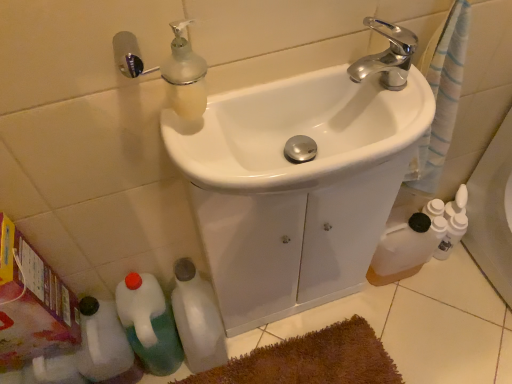
Image resolution: width=512 pixels, height=384 pixels. Describe the element at coordinates (197, 318) in the screenshot. I see `white matte bottle at lower left, which is the 3th bottle from left to right` at that location.

The height and width of the screenshot is (384, 512). What do you see at coordinates (149, 323) in the screenshot?
I see `green plastic bottle at lower left, the second bottle viewed from the left` at bounding box center [149, 323].

Identify the location of white plastic bottle at lower left, acting as the first bottle starting from the left. (104, 345).

What is the approximate width of white plastic bottle at lower left, which appears as the third bottle when viewed from the right?

7.76 inches.

Describe the element at coordinates (300, 180) in the screenshot. The width and height of the screenshot is (512, 384). I see `white glossy sink at center, the 1th sink when ordered from back to front` at that location.

Where is `white matte bottle at lower left, which is the 3th bottle from left to right`? This screenshot has width=512, height=384. white matte bottle at lower left, which is the 3th bottle from left to right is located at coordinates (197, 318).

Considering the positions of points (156, 320) and (169, 145), is point (156, 320) farther from camera compared to point (169, 145)?

Yes.

Could you tell me if green plastic bottle at lower left, the second bottle viewed from the left, is turned towards white glossy sink at center, the 2th sink viewed from the front?

No, green plastic bottle at lower left, the second bottle viewed from the left, is not facing towards white glossy sink at center, the 2th sink viewed from the front.

There is a white glossy sink at center, the 2th sink viewed from the front. Where is `the 1st bottle below it (from a real-world perspective)`? The width and height of the screenshot is (512, 384). the 1st bottle below it (from a real-world perspective) is located at coordinates (149, 323).

Considering the sizes of green plastic bottle at lower left, the second bottle viewed from the left, and white glossy sink at center, the 2th sink viewed from the front, in the image, is green plastic bottle at lower left, the second bottle viewed from the left, bigger or smaller than white glossy sink at center, the 2th sink viewed from the front,?

In the image, green plastic bottle at lower left, the second bottle viewed from the left, appears to be smaller than white glossy sink at center, the 2th sink viewed from the front.

From the picture: From a real-world perspective, is white plastic bottle at lower left, which appears as the third bottle when viewed from the right, above or below white glossy sink at center, the 1th sink when ordered from back to front?

white plastic bottle at lower left, which appears as the third bottle when viewed from the right, is below white glossy sink at center, the 1th sink when ordered from back to front.

Which of these two, white plastic bottle at lower left, which appears as the third bottle when viewed from the right, or white glossy sink at center, the 2th sink viewed from the front, stands shorter?

Result: Standing shorter between the two is white plastic bottle at lower left, which appears as the third bottle when viewed from the right.

Is white plastic bottle at lower left, which appears as the third bottle when viewed from the right, far away from white glossy sink at center, the 2th sink viewed from the front?

No, white plastic bottle at lower left, which appears as the third bottle when viewed from the right, is not far from white glossy sink at center, the 2th sink viewed from the front.

Is white matte bottle at lower left, which is the 3th bottle from left to right, surrounded by white plastic bottle at lower left, acting as the first bottle starting from the left?

No, white matte bottle at lower left, which is the 3th bottle from left to right, is located outside of white plastic bottle at lower left, acting as the first bottle starting from the left.

Is white plastic bottle at lower left, which appears as the third bottle when viewed from the right, in contact with white matte bottle at lower left, which is the 3th bottle from left to right?

No, white plastic bottle at lower left, which appears as the third bottle when viewed from the right, is not next to white matte bottle at lower left, which is the 3th bottle from left to right.

Considering the relative sizes of white plastic bottle at lower left, which appears as the third bottle when viewed from the right, and white matte bottle at lower left, which is the 1th bottle in right-to-left order, in the image provided, is white plastic bottle at lower left, which appears as the third bottle when viewed from the right, wider than white matte bottle at lower left, which is the 1th bottle in right-to-left order,?

No.

From the image's perspective, does green plastic bottle at lower left, which is the second bottle from right to left, appear higher than white glossy sink at center, positioned as the first sink in front-to-back order?

Incorrect, from the image's perspective, green plastic bottle at lower left, which is the second bottle from right to left, is lower than white glossy sink at center, positioned as the first sink in front-to-back order.

Which of these two, green plastic bottle at lower left, the second bottle viewed from the left, or white glossy sink at center, the 2th sink viewed from the back, is thinner?

green plastic bottle at lower left, the second bottle viewed from the left.

Between green plastic bottle at lower left, the second bottle viewed from the left, and white glossy sink at center, the 2th sink viewed from the back, which one has more height?

green plastic bottle at lower left, the second bottle viewed from the left, is taller.

How much distance is there between green plastic bottle at lower left, which is the second bottle from right to left, and white glossy sink at center, positioned as the first sink in front-to-back order?

23.97 inches.

Which point is more distant from viewer, (303, 120) or (150, 356)?

The point (150, 356) is more distant.

Is white glossy sink at center, positioned as the first sink in front-to-back order, wider than green plastic bottle at lower left, which is the second bottle from right to left?

Indeed, white glossy sink at center, positioned as the first sink in front-to-back order, has a greater width compared to green plastic bottle at lower left, which is the second bottle from right to left.

From the image's perspective, is white glossy sink at center, positioned as the first sink in front-to-back order, on green plastic bottle at lower left, which is the second bottle from right to left?

Indeed, from the image's perspective, white glossy sink at center, positioned as the first sink in front-to-back order, is shown above green plastic bottle at lower left, which is the second bottle from right to left.

How distant is white glossy sink at center, positioned as the first sink in front-to-back order, from green plastic bottle at lower left, the second bottle viewed from the left?

The distance of white glossy sink at center, positioned as the first sink in front-to-back order, from green plastic bottle at lower left, the second bottle viewed from the left, is 23.97 inches.

Does brown plush bath mat at lower center have a lesser height compared to white glossy sink at center, the 2th sink viewed from the back?

Yes, brown plush bath mat at lower center is shorter than white glossy sink at center, the 2th sink viewed from the back.

Considering the relative positions of brown plush bath mat at lower center and white glossy sink at center, positioned as the first sink in front-to-back order, in the image provided, is brown plush bath mat at lower center to the right of white glossy sink at center, positioned as the first sink in front-to-back order, from the viewer's perspective?

No, brown plush bath mat at lower center is not to the right of white glossy sink at center, positioned as the first sink in front-to-back order.

Between brown plush bath mat at lower center and white glossy sink at center, positioned as the first sink in front-to-back order, which one has smaller size?

With smaller size is brown plush bath mat at lower center.

What's the angular difference between brown plush bath mat at lower center and white glossy sink at center, the 2th sink viewed from the back,'s facing directions?

The angular difference between brown plush bath mat at lower center and white glossy sink at center, the 2th sink viewed from the back, is 89.4 degrees.

Between point (262, 146) and point (135, 369), which one is positioned in front?

The point (262, 146) is more forward.

Is white plastic bottle at lower left, acting as the first bottle starting from the left, a part of white glossy sink at center, positioned as the first sink in front-to-back order?

No, white plastic bottle at lower left, acting as the first bottle starting from the left, is not a part of white glossy sink at center, positioned as the first sink in front-to-back order.

Is white glossy sink at center, positioned as the first sink in front-to-back order, next to white plastic bottle at lower left, which appears as the third bottle when viewed from the right?

No, white glossy sink at center, positioned as the first sink in front-to-back order, is not touching white plastic bottle at lower left, which appears as the third bottle when viewed from the right.

From the image's perspective, would you say white glossy sink at center, positioned as the first sink in front-to-back order, is shown under white plastic bottle at lower left, which appears as the third bottle when viewed from the right?

No, from the image's perspective, white glossy sink at center, positioned as the first sink in front-to-back order, is not below white plastic bottle at lower left, which appears as the third bottle when viewed from the right.

Find the location of a particular element. The height and width of the screenshot is (384, 512). the 1st bottle behind the white glossy sink at center, the 1th sink when ordered from back to front is located at coordinates (149, 323).

From the image's perspective, starting from the white plastic bottle at lower left, which appears as the third bottle when viewed from the right, which sink is the 1st one above? Please provide its 2D coordinates.

[(300, 180)]

Which object lies nearer to the anchor point white plastic bottle at lower left, which appears as the third bottle when viewed from the right, green plastic bottle at lower left, the second bottle viewed from the left, or white glossy sink at center, positioned as the first sink in front-to-back order?

The object closer to white plastic bottle at lower left, which appears as the third bottle when viewed from the right, is green plastic bottle at lower left, the second bottle viewed from the left.

From the picture: When comparing their distances from white glossy sink at center, the 2th sink viewed from the front, does white plastic bottle at lower left, which appears as the third bottle when viewed from the right, or white glossy sink at center, positioned as the first sink in front-to-back order, seem further?

The object further to white glossy sink at center, the 2th sink viewed from the front, is white plastic bottle at lower left, which appears as the third bottle when viewed from the right.

In the scene shown: Looking at the image, which one is located further to green plastic bottle at lower left, which is the second bottle from right to left, white plastic bottle at lower left, acting as the first bottle starting from the left, or white glossy sink at center, the 2th sink viewed from the back?

white glossy sink at center, the 2th sink viewed from the back.

From the image, which object appears to be nearer to white matte bottle at lower left, which is the 3th bottle from left to right, brown plush bath mat at lower center or green plastic bottle at lower left, which is the second bottle from right to left?

green plastic bottle at lower left, which is the second bottle from right to left, lies closer to white matte bottle at lower left, which is the 3th bottle from left to right, than the other object.

Which object lies further to the anchor point green plastic bottle at lower left, the second bottle viewed from the left, brown plush bath mat at lower center or white glossy sink at center, positioned as the first sink in front-to-back order?

white glossy sink at center, positioned as the first sink in front-to-back order, is further to green plastic bottle at lower left, the second bottle viewed from the left.

Consider the image. Looking at the image, which one is located further to white glossy sink at center, the 2th sink viewed from the back, white glossy sink at center, the 2th sink viewed from the front, or brown plush bath mat at lower center?

brown plush bath mat at lower center is further to white glossy sink at center, the 2th sink viewed from the back.

Based on their spatial positions, is green plastic bottle at lower left, which is the second bottle from right to left, or brown plush bath mat at lower center closer to white glossy sink at center, the 2th sink viewed from the back?

green plastic bottle at lower left, which is the second bottle from right to left, is positioned closer to the anchor white glossy sink at center, the 2th sink viewed from the back.

When comparing their distances from white plastic bottle at lower left, which appears as the third bottle when viewed from the right, does white matte bottle at lower left, which is the 1th bottle in right-to-left order, or white glossy sink at center, positioned as the first sink in front-to-back order, seem closer?

white matte bottle at lower left, which is the 1th bottle in right-to-left order.

The height and width of the screenshot is (384, 512). Find the location of `bottle situated between green plastic bottle at lower left, the second bottle viewed from the left, and brown plush bath mat at lower center from left to right`. bottle situated between green plastic bottle at lower left, the second bottle viewed from the left, and brown plush bath mat at lower center from left to right is located at coordinates (197, 318).

The height and width of the screenshot is (384, 512). What are the coordinates of `bottle between white glossy sink at center, the 2th sink viewed from the back, and green plastic bottle at lower left, the second bottle viewed from the left, in the vertical direction` in the screenshot? It's located at (197, 318).

In order to click on sink between white glossy sink at center, positioned as the first sink in front-to-back order, and white matte bottle at lower left, which is the 1th bottle in right-to-left order, vertically in this screenshot , I will do `click(300, 180)`.

In order to click on sink situated between white plastic bottle at lower left, acting as the first bottle starting from the left, and white glossy sink at center, the 2th sink viewed from the front, from left to right in this screenshot , I will do `click(298, 130)`.